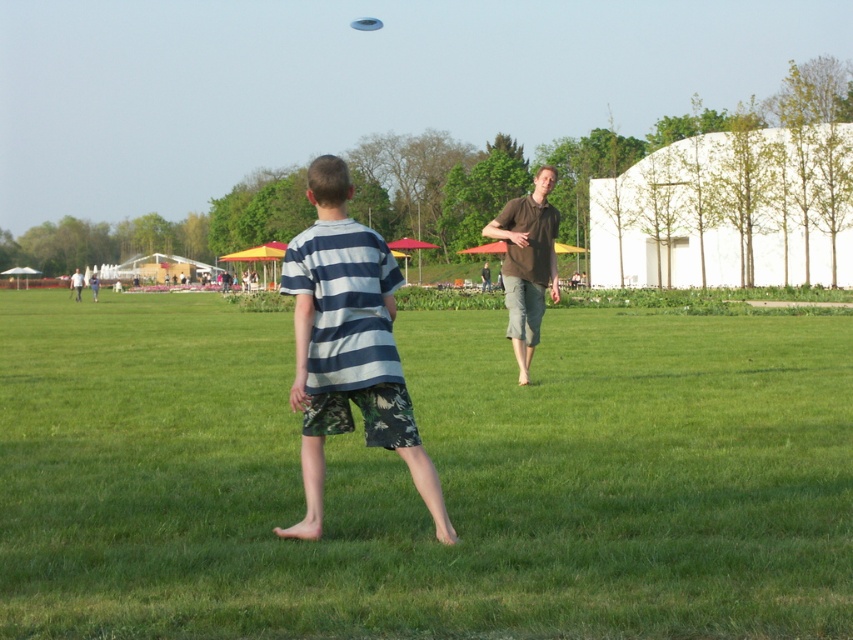
You are a photographer trying to capture both the striped cotton shirt at center and the brown cotton shirt at center in a single shot. Given that your camera has a limited focus range, which shirt should you prioritize focusing on to ensure it appears sharp, considering their sizes?

The striped cotton shirt at center is bigger than the brown cotton shirt at center, so you should prioritize focusing on the striped cotton shirt at center to ensure it appears sharp as it occupies more space in the frame.